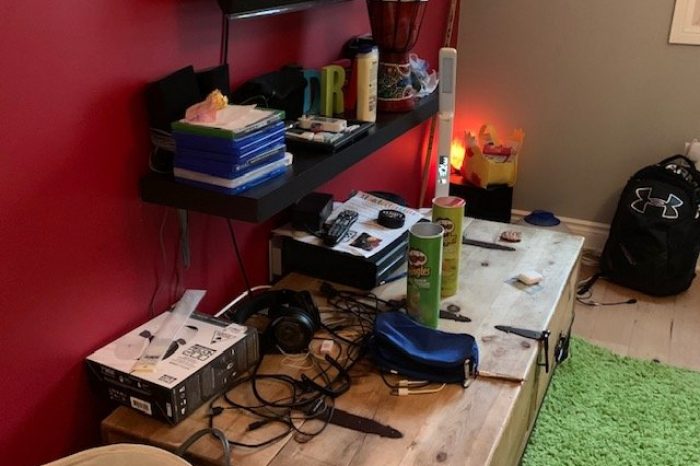
You are a GUI agent. You are given a task and a screenshot of the screen. Output one action in this format:
    pyautogui.click(x=<x>, y=<y>)
    Task: Click on the video game or dvd/blu ray boxes
    
    Given the screenshot: What is the action you would take?
    pyautogui.click(x=253, y=133), pyautogui.click(x=253, y=139), pyautogui.click(x=253, y=143), pyautogui.click(x=259, y=153), pyautogui.click(x=259, y=160), pyautogui.click(x=260, y=166), pyautogui.click(x=260, y=172)